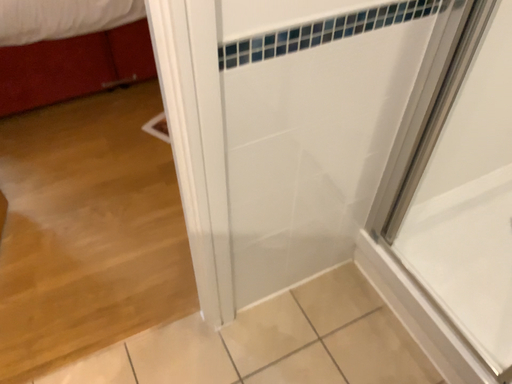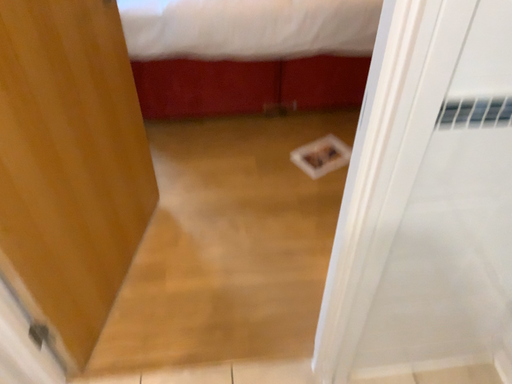
Question: Which way did the camera rotate in the video?

Choices:
 (A) rotated right
 (B) rotated left

Answer: (B)